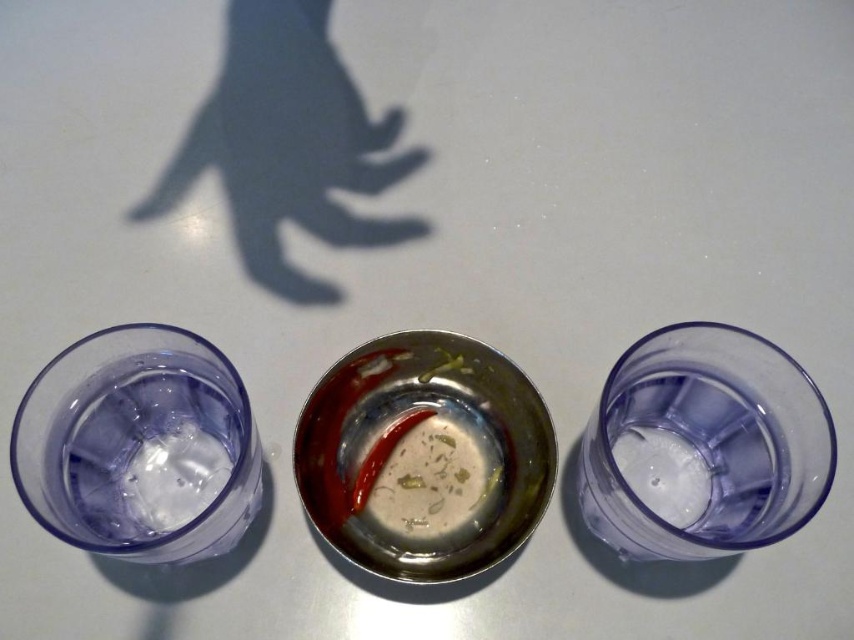
Is transparent plastic shot glass at center right in front of transparent plastic shot glass at left?

That is False.

Does point (771, 397) come closer to viewer compared to point (164, 531)?

Yes, point (771, 397) is in front of point (164, 531).

Describe the element at coordinates (703, 445) in the screenshot. The image size is (854, 640). I see `transparent plastic shot glass at center right` at that location.

Image resolution: width=854 pixels, height=640 pixels. I want to click on transparent plastic shot glass at center right, so click(x=703, y=445).